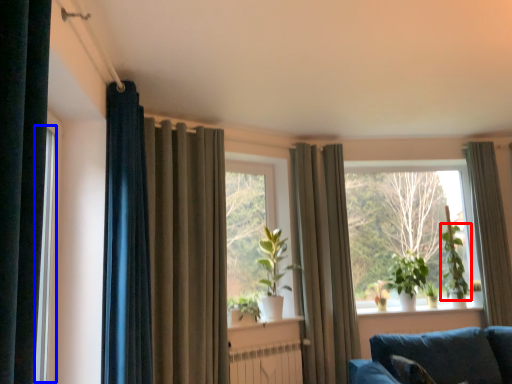
Question: Which point is further to the camera, plant (highlighted by a red box) or window frame (highlighted by a blue box)?

Choices:
 (A) plant
 (B) window frame

Answer: (A)